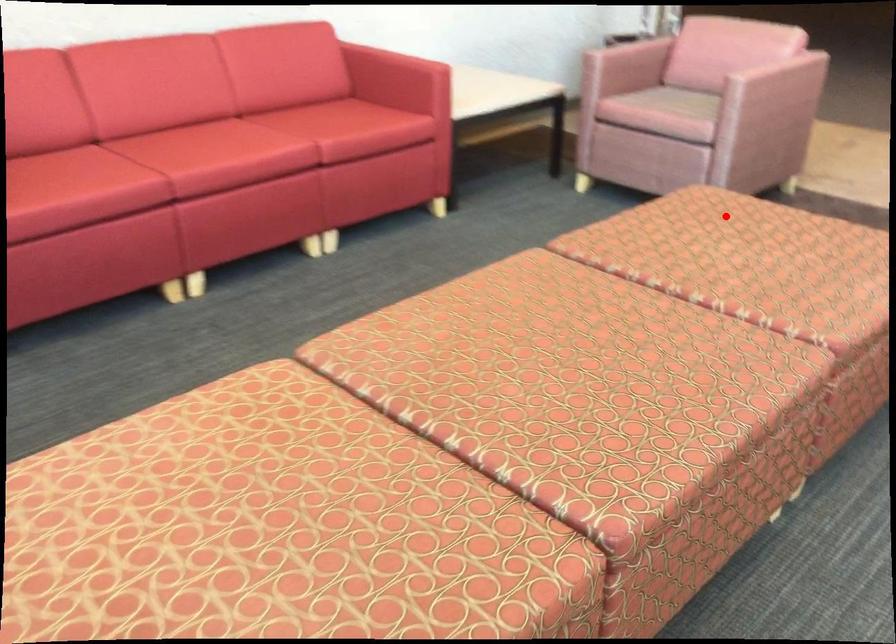
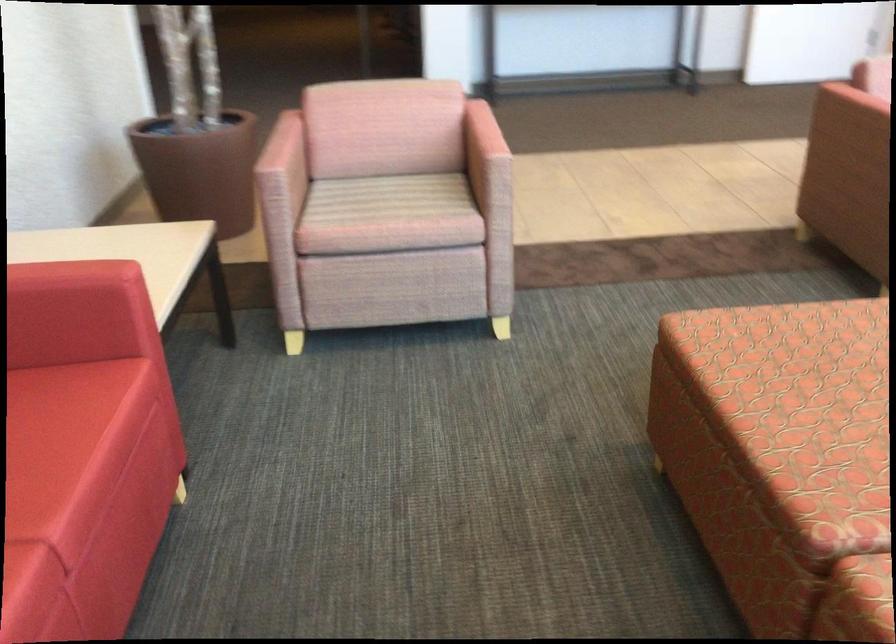
Where in the second image is the point corresponding to the highlighted location from the first image?

(782, 350)